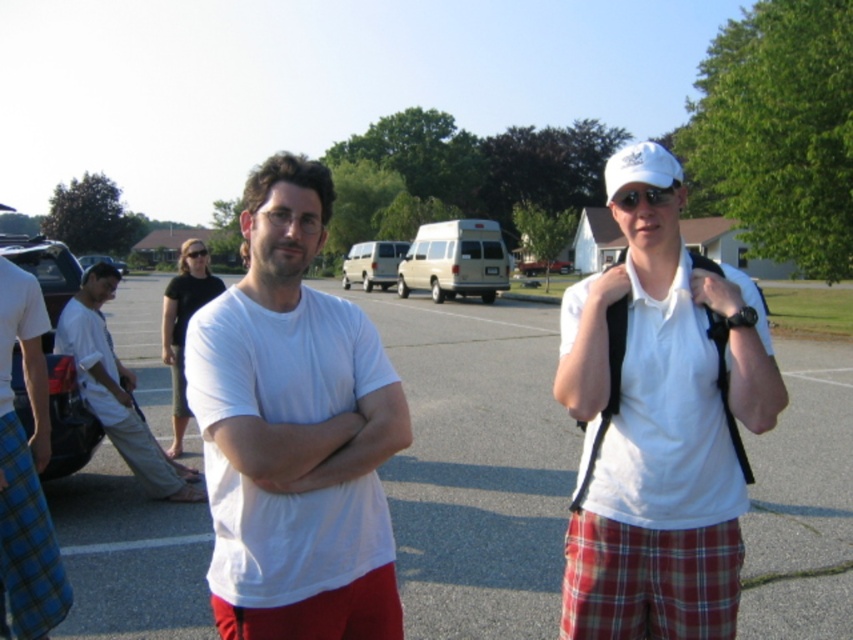
Can you confirm if white matte t-shirt at center is smaller than matte black glasses at center?

Incorrect, white matte t-shirt at center is not smaller in size than matte black glasses at center.

Is point (235, 326) farther from viewer compared to point (198, 252)?

That is False.

Which is in front, point (270, 179) or point (198, 253)?

Point (270, 179) is in front.

This screenshot has height=640, width=853. In order to click on white matte t-shirt at center in this screenshot , I will do `click(294, 432)`.

Can you confirm if white matte t-shirt at center is positioned to the left of white cotton shirt at center?

In fact, white matte t-shirt at center is to the right of white cotton shirt at center.

At what (x,y) coordinates should I click in order to perform the action: click on white matte t-shirt at center. Please return your answer as a coordinate pair (x, y). Looking at the image, I should click on (294, 432).

This screenshot has width=853, height=640. Describe the element at coordinates (294, 432) in the screenshot. I see `white matte t-shirt at center` at that location.

Locate an element on the screen. This screenshot has width=853, height=640. white matte t-shirt at center is located at coordinates [x=294, y=432].

Can you confirm if gray asphalt parking lot at center is bigger than red plaid kilt at center?

Yes.

Can you confirm if gray asphalt parking lot at center is positioned to the left of red plaid kilt at center?

Yes, gray asphalt parking lot at center is to the left of red plaid kilt at center.

This screenshot has height=640, width=853. Identify the location of gray asphalt parking lot at center. (477, 467).